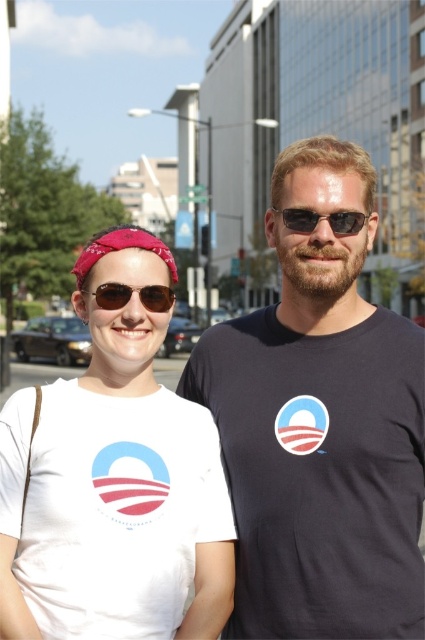
Question: Can you confirm if white matte t-shirt at center is positioned to the left of matte brown sunglasses at center?

Choices:
 (A) no
 (B) yes

Answer: (B)

Question: Is red bandana at center further to the viewer compared to sunglasses at center?

Choices:
 (A) no
 (B) yes

Answer: (A)

Question: Does dark gray t-shirt at center appear on the left side of sunglasses at center?

Choices:
 (A) no
 (B) yes

Answer: (B)

Question: Which point is closer to the camera?

Choices:
 (A) red bandana at center
 (B) white matte t-shirt at center
 (C) matte brown sunglasses at center

Answer: (B)

Question: Which point is closer to the camera?

Choices:
 (A) red bandana at center
 (B) dark gray t-shirt at center
 (C) white matte t-shirt at center
 (D) matte brown sunglasses at center

Answer: (C)

Question: Which point is closer to the camera taking this photo?

Choices:
 (A) (74, 275)
 (B) (164, 305)
 (C) (14, 406)

Answer: (C)